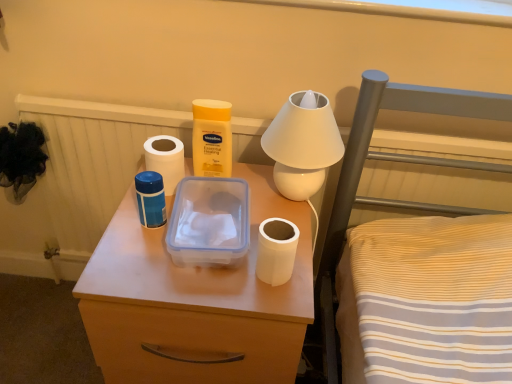
Identify the location of vacant space in front of white matte toilet paper at left, the second toilet paper from the front. (138, 246).